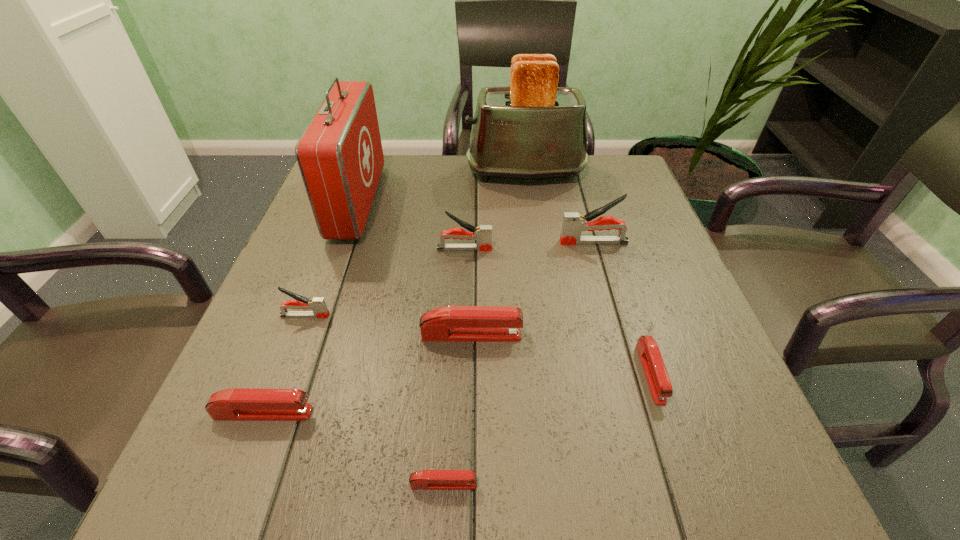
Identify the location of free space at the near left corner. This screenshot has height=540, width=960. (186, 497).

The width and height of the screenshot is (960, 540). Find the location of `vacant space at the far right corner of the desktop`. vacant space at the far right corner of the desktop is located at coordinates (x=581, y=198).

The height and width of the screenshot is (540, 960). In order to click on blank region between the fourth nearest object and the nearest stapler in this screenshot , I will do `click(457, 410)`.

Image resolution: width=960 pixels, height=540 pixels. Find the location of `unoccupied position between the nearest gray stapler and the third shortest object`. unoccupied position between the nearest gray stapler and the third shortest object is located at coordinates (284, 364).

The height and width of the screenshot is (540, 960). What are the coordinates of `free area in between the second biggest gray stapler and the red first-aid kit` in the screenshot? It's located at (411, 226).

Locate an element on the screen. This screenshot has height=540, width=960. free space between the nearest object and the fourth farthest stapler is located at coordinates (457, 410).

Locate an element on the screen. vacant space that is in between the first-aid kit and the leftmost gray stapler is located at coordinates (331, 259).

Identify the location of unoccupied area between the red first-aid kit and the shortest object. The height and width of the screenshot is (540, 960). coord(400,343).

Where is `free space between the second smallest red stapler and the nearest object`? free space between the second smallest red stapler and the nearest object is located at coordinates (547, 429).

Where is `free spot between the nearest gray stapler and the nearest stapler`? Image resolution: width=960 pixels, height=540 pixels. free spot between the nearest gray stapler and the nearest stapler is located at coordinates click(374, 400).